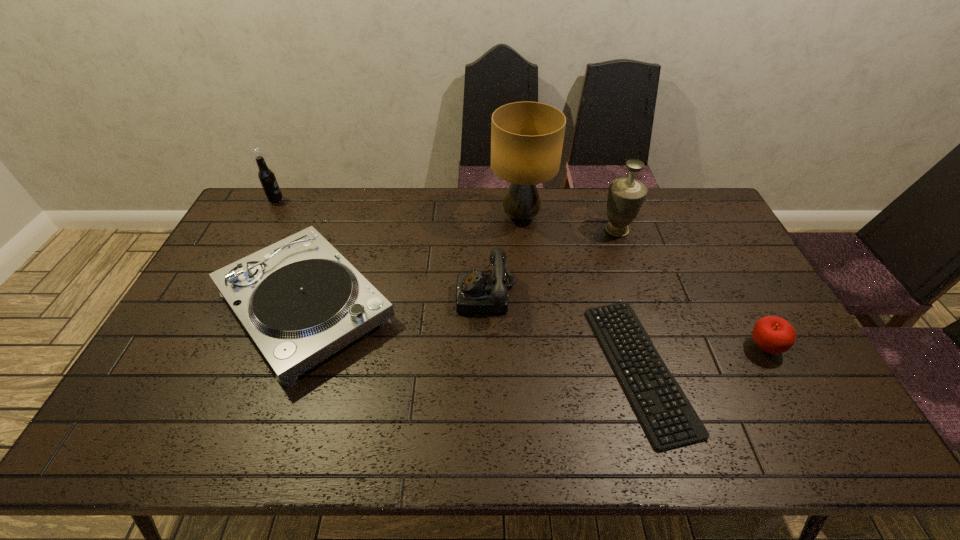
Identify the location of lampshade. (527, 138).

Find the location of a particular element. Image resolution: width=960 pixels, height=540 pixels. the sixth shortest object is located at coordinates (625, 198).

At what (x,y) coordinates should I click in order to perform the action: click on root beer. Please return your answer as a coordinate pair (x, y). The image size is (960, 540). Looking at the image, I should click on (266, 176).

The image size is (960, 540). Identify the location of the fourth tallest object. (476, 292).

The width and height of the screenshot is (960, 540). In order to click on record player in this screenshot , I will do `click(300, 301)`.

Where is `apple`? This screenshot has height=540, width=960. apple is located at coordinates (772, 334).

Identify the location of computer keyboard. This screenshot has width=960, height=540. (668, 418).

The image size is (960, 540). Identify the location of vacant region located 0.050m on the left of the tallest object. (476, 217).

Find the location of a particular element. The image size is (960, 540). vacant space located 0.250m on the right of the urn is located at coordinates (706, 230).

This screenshot has height=540, width=960. Find the location of `blank space located 0.300m on the label of the fifth shortest object`. blank space located 0.300m on the label of the fifth shortest object is located at coordinates (363, 201).